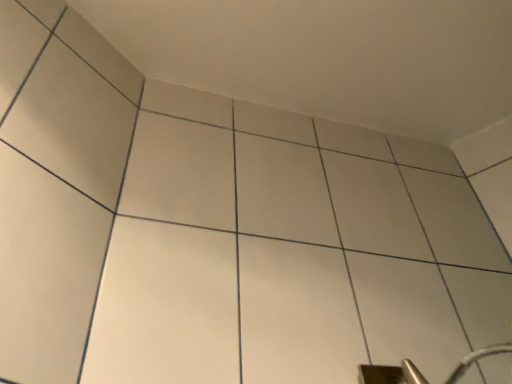
The height and width of the screenshot is (384, 512). What do you see at coordinates (406, 313) in the screenshot?
I see `white glossy ceramic tile at lower right` at bounding box center [406, 313].

The height and width of the screenshot is (384, 512). Identify the location of white glossy ceramic tile at lower right. (406, 313).

Measure the distance between point (368,340) and camera.

The depth of point (368,340) is 32.83 inches.

Identify the location of white glossy ceramic tile at lower right. (406, 313).